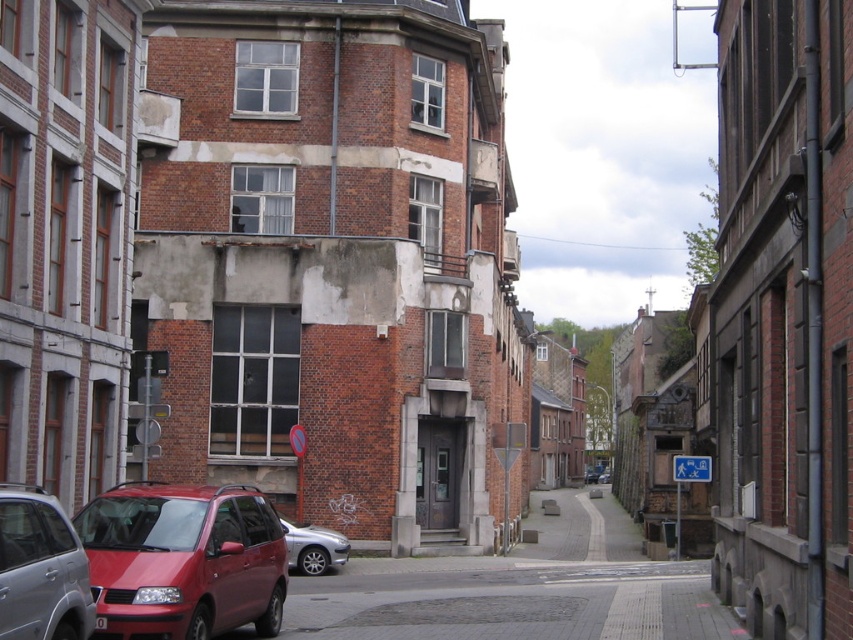
Question: Estimate the real-world distances between objects in this image. Which object is farther from the matte red minivan at lower left?

Choices:
 (A) matte red van at center
 (B) matte red car at lower left
 (C) metallic red car at center
 (D) silver metallic car at center

Answer: (A)

Question: From the image, what is the correct spatial relationship of matte red car at lower left in relation to matte red van at center?

Choices:
 (A) above
 (B) below

Answer: (A)

Question: Considering the relative positions of matte red car at lower left and matte red van at center in the image provided, where is matte red car at lower left located with respect to matte red van at center?

Choices:
 (A) left
 (B) right

Answer: (A)

Question: Is matte red minivan at lower left positioned in front of matte red car at lower left?

Choices:
 (A) yes
 (B) no

Answer: (B)

Question: Which point is farther to the camera?

Choices:
 (A) matte red car at lower left
 (B) matte red van at center
 (C) metallic red car at center

Answer: (B)

Question: Which of the following is the closest to the observer?

Choices:
 (A) (601, 468)
 (B) (67, 592)
 (C) (605, 476)
 (D) (318, 541)

Answer: (B)